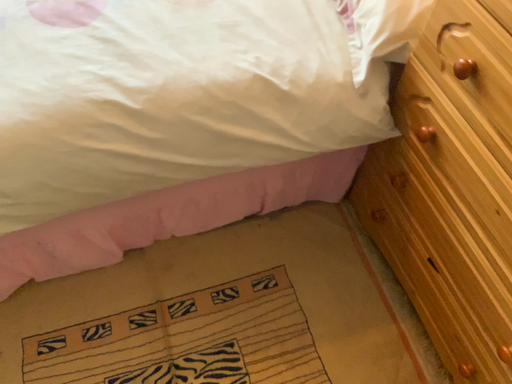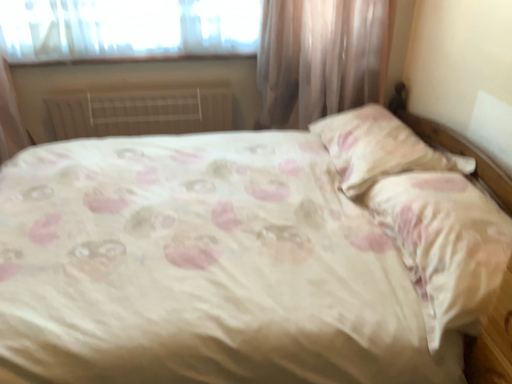
Question: How did the camera likely rotate when shooting the video?

Choices:
 (A) rotated downward
 (B) rotated upward

Answer: (B)